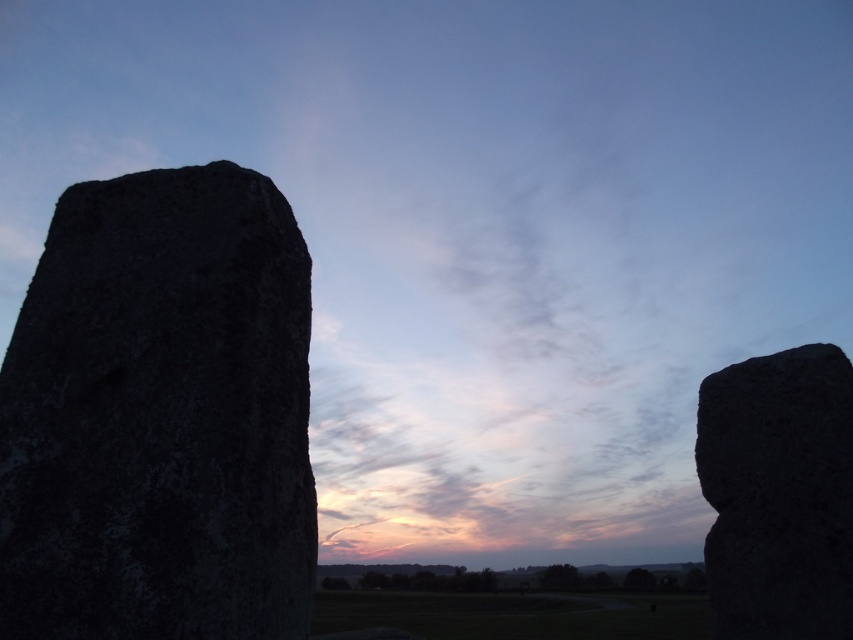
You are standing at the prehistoric stone monument site and want to touch both the granite rock at left and the granite boulder at right. Which one would you reach first if you walk straight ahead?

You would reach the granite rock at left first because it is closer to you than the granite boulder at right.

You are an archaeologist examining the prehistoric stone monument site. You notice the granite rock at left and the granite boulder at right. Which of these two objects is taller?

The granite boulder at right is taller than the granite rock at left.